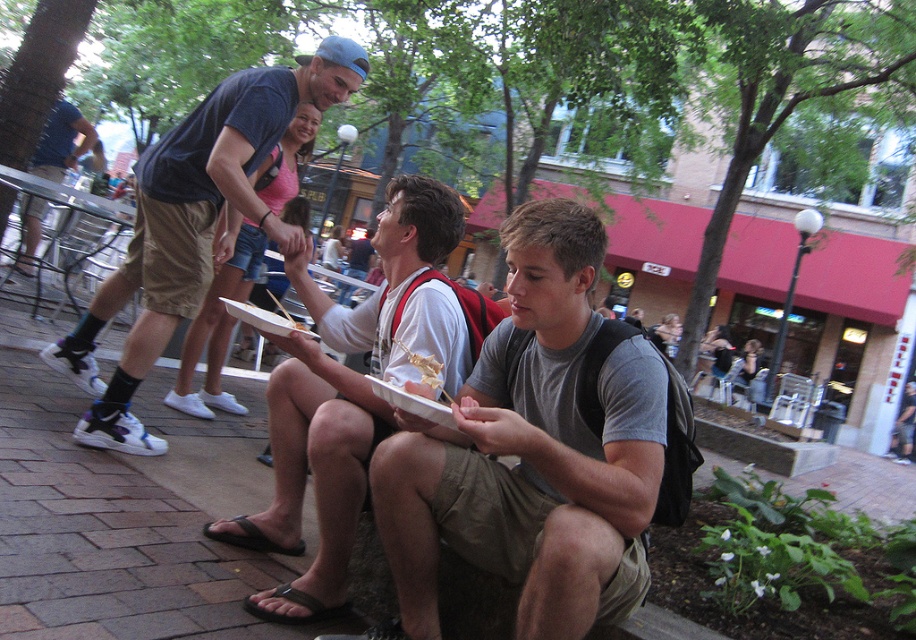
Question: Considering the relative positions of gray cotton t-shirt at center and matte blue shirt at center in the image provided, where is gray cotton t-shirt at center located with respect to matte blue shirt at center?

Choices:
 (A) above
 (B) below

Answer: (B)

Question: Which object is closer to the camera taking this photo?

Choices:
 (A) white matte shirt at center
 (B) matte blue shirt at center
 (C) gray cotton t-shirt at center

Answer: (C)

Question: Observing the image, what is the correct spatial positioning of white matte shirt at center in reference to matte blue t-shirt at center?

Choices:
 (A) below
 (B) above

Answer: (A)

Question: Which point is farther from the camera taking this photo?

Choices:
 (A) (326, 364)
 (B) (263, 212)
 (C) (80, 144)
 (D) (495, 401)

Answer: (C)

Question: Can you confirm if matte blue t-shirt at center is positioned to the right of matte blue shirt at center?

Choices:
 (A) no
 (B) yes

Answer: (B)

Question: Which of these objects is positioned closest to the matte blue t-shirt at center?

Choices:
 (A) gray cotton t-shirt at center
 (B) matte blue shirt at center
 (C) white matte shirt at center

Answer: (C)